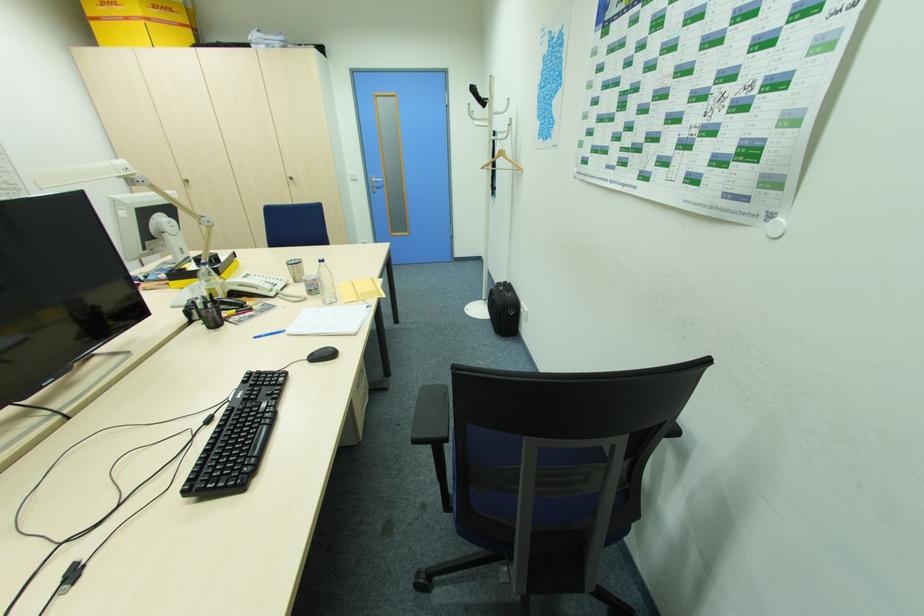
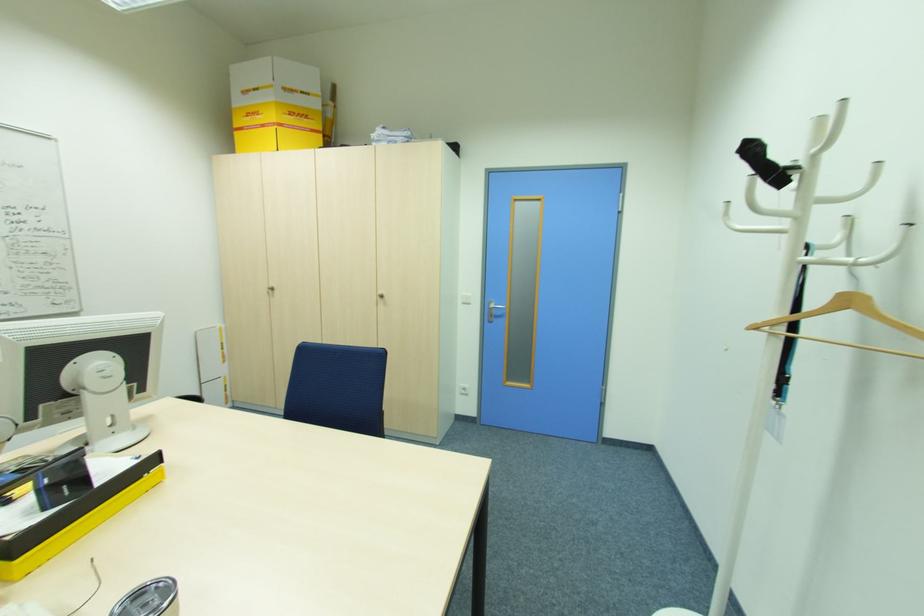
Question: The images are taken continuously from a first-person perspective. In which direction are you moving?

Choices:
 (A) Left
 (B) Right
 (C) Forward
 (D) Backward

Answer: (C)